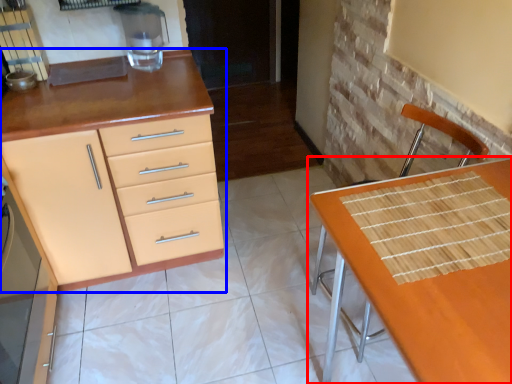
Question: Which object is closer to the camera taking this photo, table (highlighted by a red box) or cabinetry (highlighted by a blue box)?

Choices:
 (A) table
 (B) cabinetry

Answer: (A)